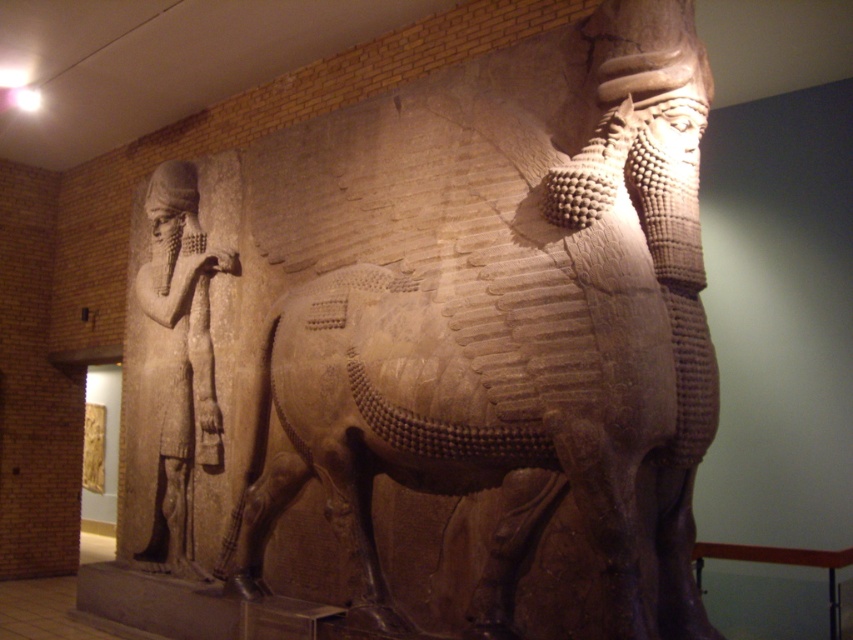
You are a museum visitor standing in front of the sculpture. You notice the brown stone horse at center and the brown stone figure at left. Which object is positioned to the right of the other?

The brown stone horse at center is to the right of the brown stone figure at left.

You are an art conservator examining the relief sculpture. You notice two points of concern on the sculpture. The first point is at coordinate point (x=657, y=376) and the second is at point (x=136, y=547). Which point is closer to your current position as you stand in front of the sculpture?

Point (x=657, y=376) is closer to the camera than point (x=136, y=547), so the first point is closer to your current position.

You are a museum guide standing at the entrance of the gallery. You want to point out the brown stone horse at center to a visitor. Where should you direct their attention?

The brown stone horse at center is located at point (x=502, y=323), so you should direct their attention to the center of the image.